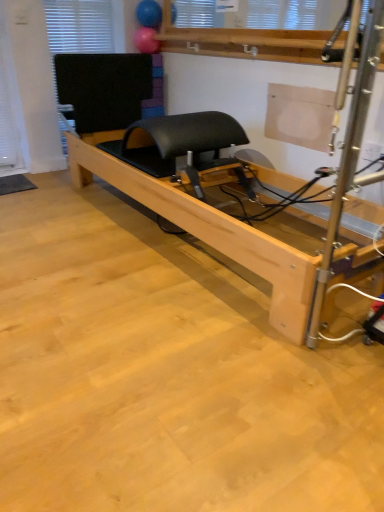
Where is `vacant area that lies in front of natural wood pilates reformer at center`? This screenshot has height=512, width=384. vacant area that lies in front of natural wood pilates reformer at center is located at coordinates [150, 340].